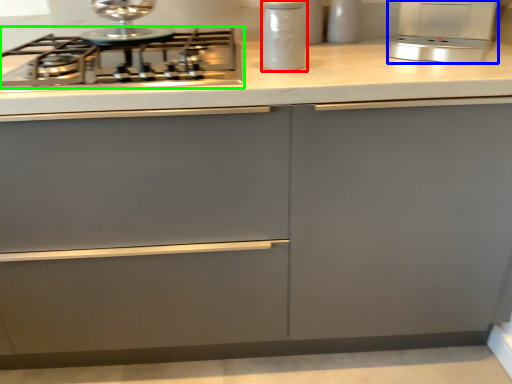
Question: Which is farther away from kitchen appliance (highlighted by a red box)? kitchen appliance (highlighted by a blue box) or gas stove (highlighted by a green box)?

Choices:
 (A) kitchen appliance
 (B) gas stove

Answer: (A)